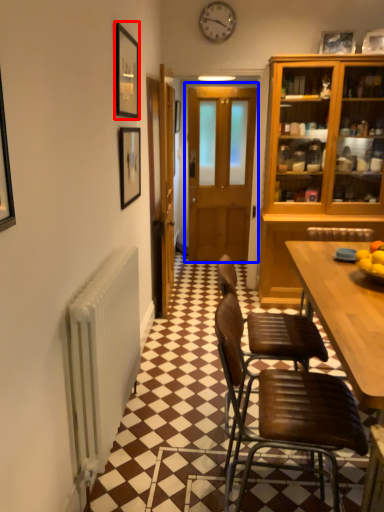
Question: Which object is closer to the camera taking this photo, picture frame (highlighted by a red box) or door (highlighted by a blue box)?

Choices:
 (A) picture frame
 (B) door

Answer: (A)